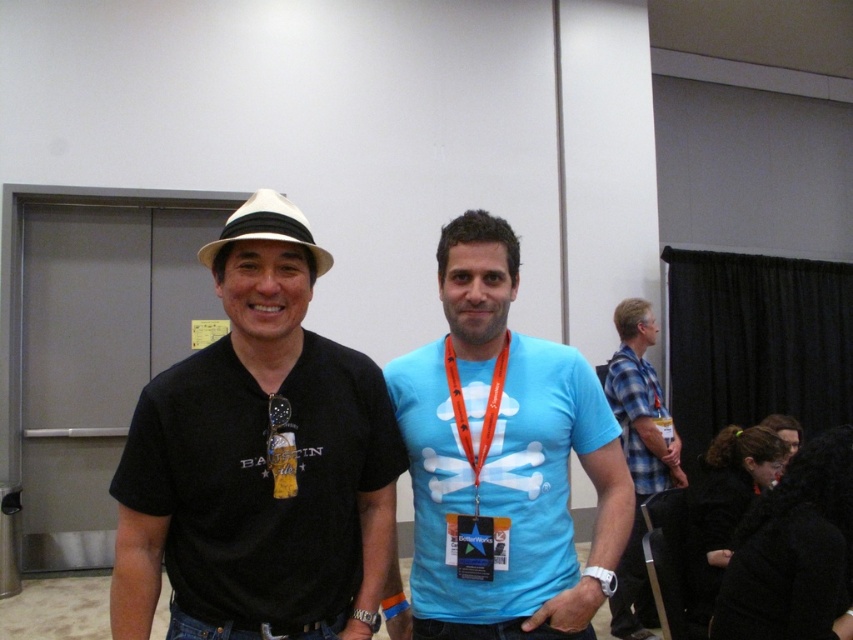
In the scene shown: Is black matte hat at left smaller than gold metallic medal at center?

Actually, black matte hat at left might be larger than gold metallic medal at center.

In the scene shown: Measure the distance between black matte hat at left and gold metallic medal at center.

The distance of black matte hat at left from gold metallic medal at center is 16.18 centimeters.

Does point (251, 376) lie in front of point (285, 404)?

No, it is not.

At what (x,y) coordinates should I click in order to perform the action: click on black matte hat at left. Please return your answer as a coordinate pair (x, y). This screenshot has width=853, height=640. Looking at the image, I should click on (256, 499).

Identify the location of black matte neck at center. (267, 346).

Between point (276, 346) and point (497, 332), which one is positioned in front?

Point (276, 346)

This screenshot has width=853, height=640. I want to click on black matte neck at center, so click(267, 346).

Is point (502, 380) closer to viewer compared to point (260, 323)?

No.

This screenshot has height=640, width=853. In order to click on blue matte t-shirt at center in this screenshot , I will do (503, 492).